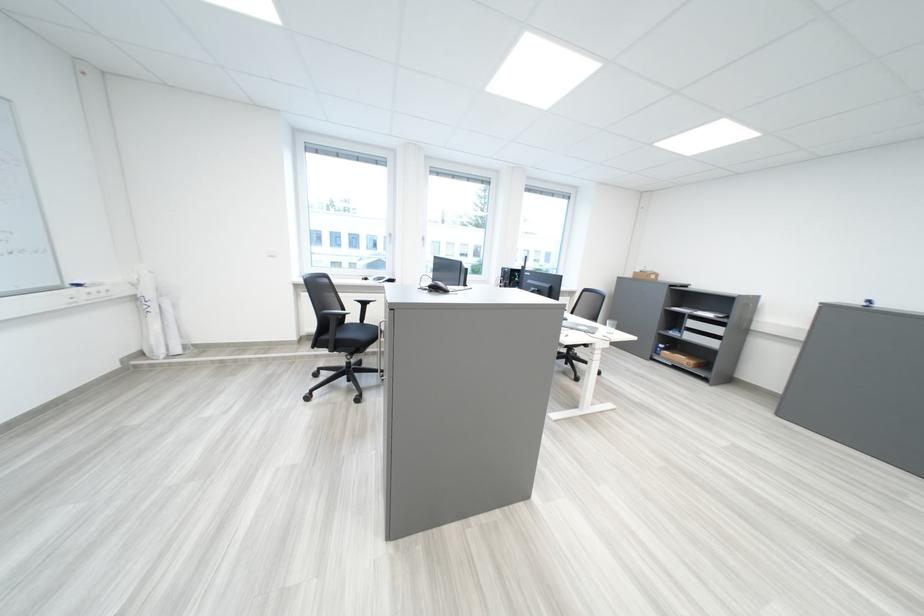
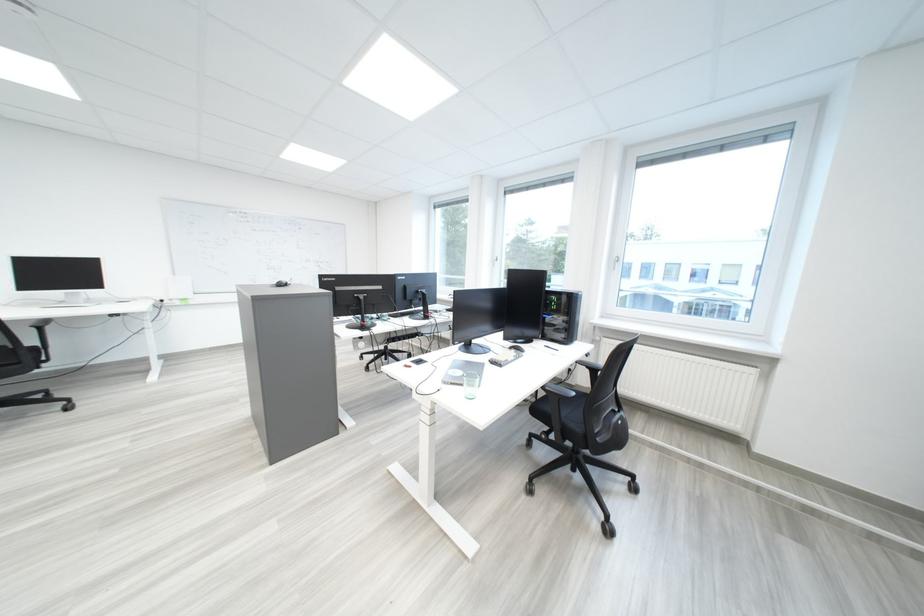
Question: I am providing you with two images of the same scene from different viewpoints. After the viewpoint changes to image2, which objects are now occluded?

Choices:
 (A) white window handle
 (B) white mesh drawer
 (C) black chair armrest
 (D) black chair sitting surface

Answer: (D)